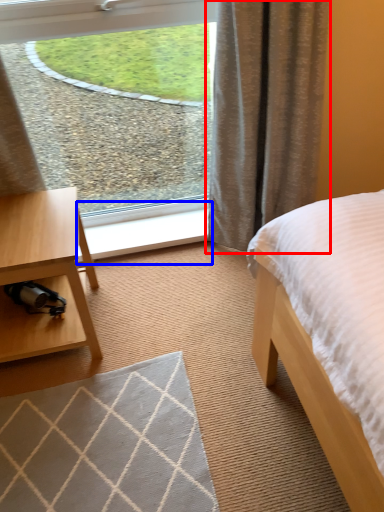
Question: Which object appears farthest to the camera in this image, curtain (highlighted by a red box) or window sill (highlighted by a blue box)?

Choices:
 (A) curtain
 (B) window sill

Answer: (B)